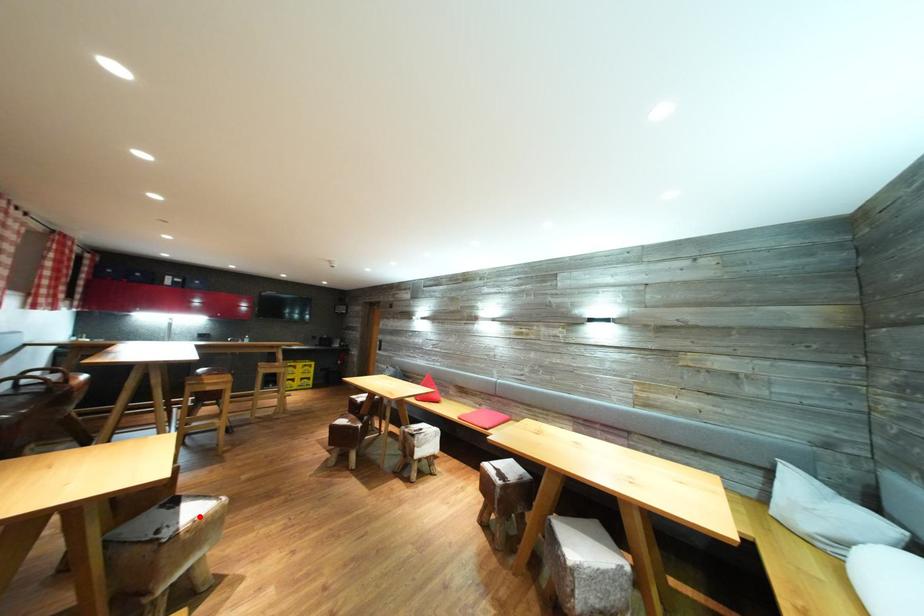
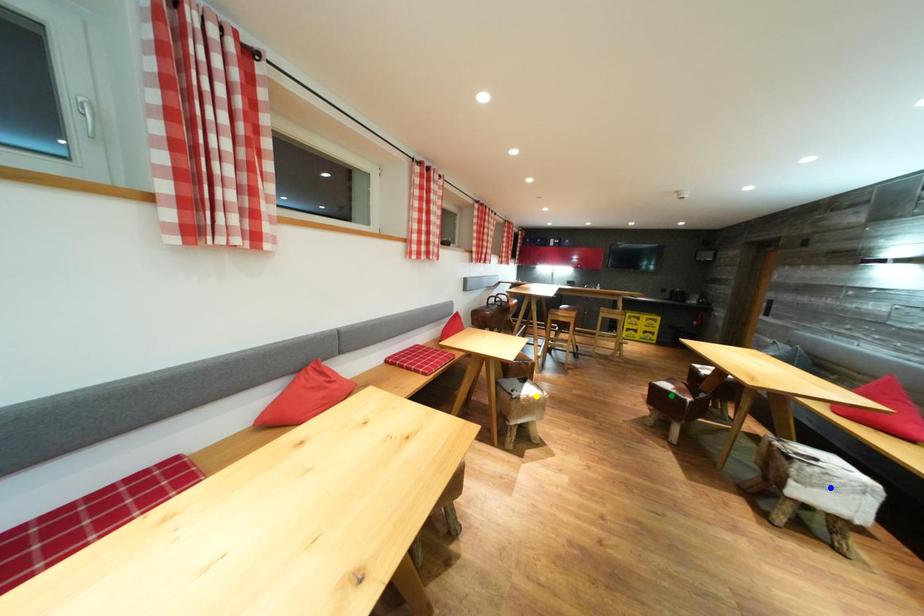
Question: I am providing you with two images of the same scene from different viewpoints. A red point is marked on the first image. You are given multiple points on the second image. Which point in image 2 is actually the same real-world point as the red point in image 1?

Choices:
 (A) blue point
 (B) green point
 (C) yellow point

Answer: (C)